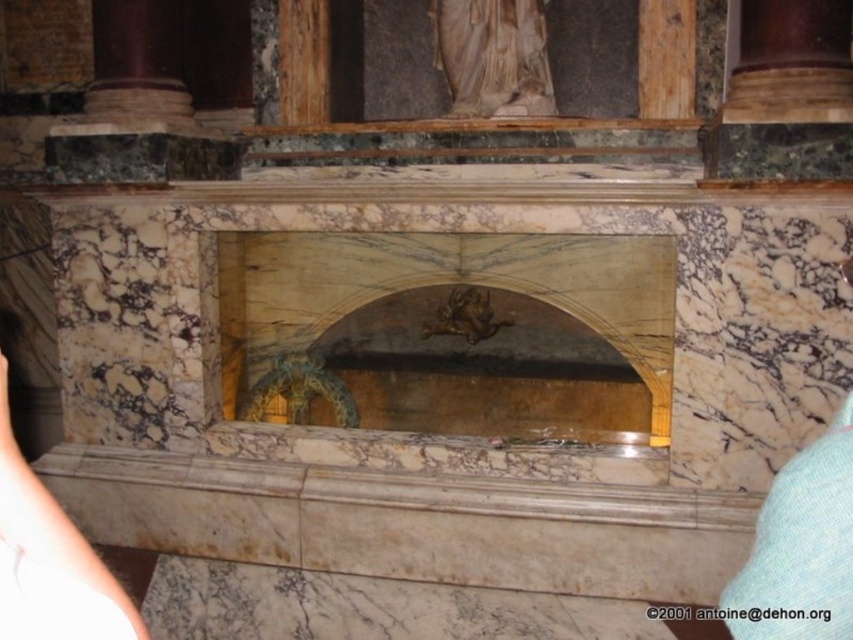
Question: Which of the following is the farthest from the observer?

Choices:
 (A) white marble statue at upper center
 (B) skinny white arm at lower left

Answer: (A)

Question: Can you confirm if skinny white arm at lower left is positioned to the right of gold metallic sculpture at center?

Choices:
 (A) yes
 (B) no

Answer: (B)

Question: Does white marble statue at upper center have a greater width compared to skinny white arm at lower left?

Choices:
 (A) yes
 (B) no

Answer: (A)

Question: Which object is the farthest from the white marble statue at upper center?

Choices:
 (A) gold metallic sculpture at center
 (B) skinny white arm at lower left

Answer: (B)

Question: Can you confirm if marble fireplace at center is wider than skinny white arm at lower left?

Choices:
 (A) no
 (B) yes

Answer: (B)

Question: Which point appears farthest from the camera in this image?

Choices:
 (A) (538, 77)
 (B) (260, 384)
 (C) (15, 525)

Answer: (A)